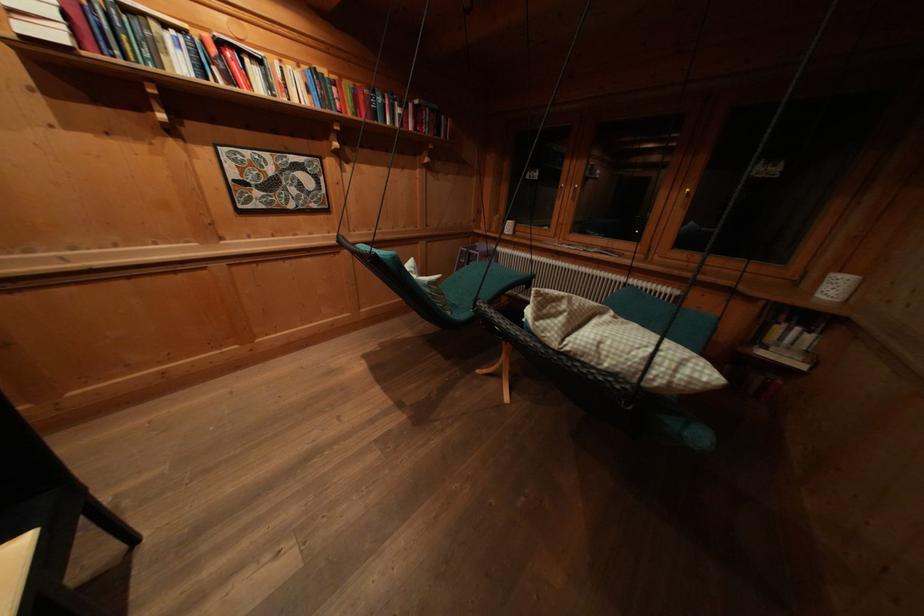
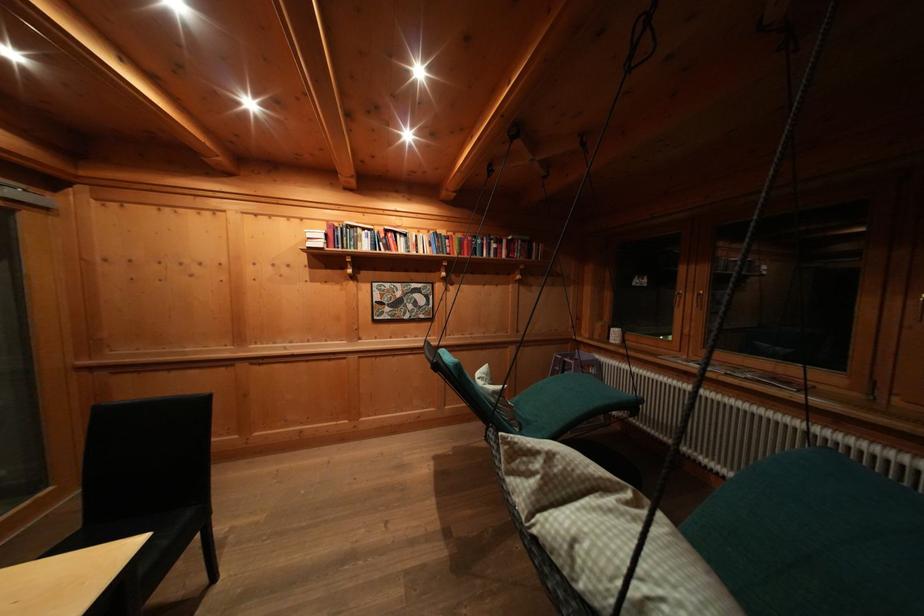
The first image is from the beginning of the video and the second image is from the end. How did the camera likely rotate when shooting the video?

The camera's rotation is toward left-up.